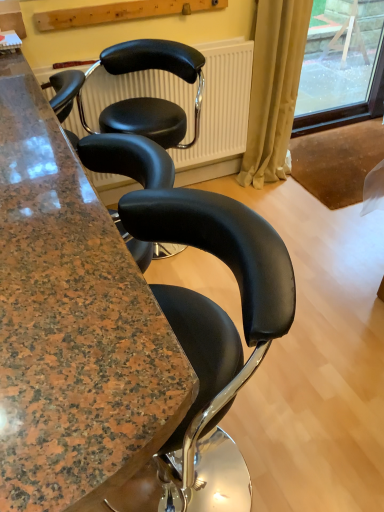
Question: Is granite countertop at center positioned behind black leather chair at center?

Choices:
 (A) no
 (B) yes

Answer: (A)

Question: Is the surface of granite countertop at center in direct contact with black leather chair at center?

Choices:
 (A) no
 (B) yes

Answer: (A)

Question: Is granite countertop at center wider than black leather chair at center?

Choices:
 (A) no
 (B) yes

Answer: (A)

Question: From the image's perspective, is granite countertop at center below black leather chair at center?

Choices:
 (A) no
 (B) yes

Answer: (B)

Question: Does granite countertop at center have a greater height compared to black leather chair at center?

Choices:
 (A) no
 (B) yes

Answer: (B)

Question: From a real-world perspective, is transparent glass window at upper right positioned above or below granite countertop at center?

Choices:
 (A) below
 (B) above

Answer: (B)

Question: Choose the correct answer: Is transparent glass window at upper right inside granite countertop at center or outside it?

Choices:
 (A) outside
 (B) inside

Answer: (A)

Question: Based on their positions, is transparent glass window at upper right located to the left or right of granite countertop at center?

Choices:
 (A) right
 (B) left

Answer: (A)

Question: Is point (357, 29) closer or farther from the camera than point (57, 309)?

Choices:
 (A) farther
 (B) closer

Answer: (A)

Question: Is transparent glass window at upper right taller or shorter than beige fabric curtain at right?

Choices:
 (A) tall
 (B) short

Answer: (B)

Question: From a real-world perspective, is transparent glass window at upper right above or below beige fabric curtain at right?

Choices:
 (A) below
 (B) above

Answer: (A)

Question: From the image's perspective, is transparent glass window at upper right above or below beige fabric curtain at right?

Choices:
 (A) above
 (B) below

Answer: (A)

Question: Considering the positions of transparent glass window at upper right and beige fabric curtain at right in the image, is transparent glass window at upper right wider or thinner than beige fabric curtain at right?

Choices:
 (A) wide
 (B) thin

Answer: (B)

Question: Is beige fabric curtain at right wider or thinner than granite countertop at center?

Choices:
 (A) wide
 (B) thin

Answer: (B)

Question: Visually, is beige fabric curtain at right positioned to the left or to the right of granite countertop at center?

Choices:
 (A) left
 (B) right

Answer: (B)